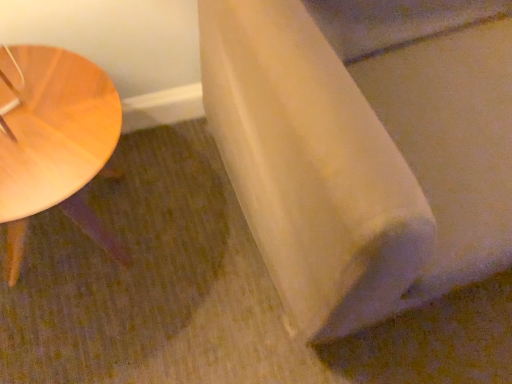
This screenshot has height=384, width=512. What do you see at coordinates (361, 159) in the screenshot?
I see `white matte fabric at lower right` at bounding box center [361, 159].

This screenshot has width=512, height=384. I want to click on white matte fabric at lower right, so click(361, 159).

Find the location of `light wood table at left`. light wood table at left is located at coordinates (x=53, y=141).

The height and width of the screenshot is (384, 512). What do you see at coordinates (53, 141) in the screenshot?
I see `light wood table at left` at bounding box center [53, 141].

Identify the location of white matte fabric at lower right. (361, 159).

Is light wood table at left to the left of white matte fabric at lower right from the viewer's perspective?

Indeed, light wood table at left is positioned on the left side of white matte fabric at lower right.

Considering the positions of objects light wood table at left and white matte fabric at lower right in the image provided, who is in front, light wood table at left or white matte fabric at lower right?

white matte fabric at lower right is more forward.

Which is closer, (x=22, y=169) or (x=296, y=79)?

The point (x=296, y=79) is closer to the camera.

From the image's perspective, is light wood table at left over white matte fabric at lower right?

Incorrect, from the image's perspective, light wood table at left is lower than white matte fabric at lower right.

From a real-world perspective, is light wood table at left located higher than white matte fabric at lower right?

No, from a real-world perspective, light wood table at left is not above white matte fabric at lower right.

Considering the relative sizes of light wood table at left and white matte fabric at lower right in the image provided, is light wood table at left thinner than white matte fabric at lower right?

Yes, light wood table at left is thinner than white matte fabric at lower right.

Considering the relative sizes of light wood table at left and white matte fabric at lower right in the image provided, is light wood table at left taller than white matte fabric at lower right?

In fact, light wood table at left may be shorter than white matte fabric at lower right.

Which of these two, light wood table at left or white matte fabric at lower right, is bigger?

white matte fabric at lower right is bigger.

Do you think light wood table at left is within white matte fabric at lower right, or outside of it?

light wood table at left exists outside the volume of white matte fabric at lower right.

Is light wood table at left placed right next to white matte fabric at lower right?

There is a gap between light wood table at left and white matte fabric at lower right.

Is light wood table at left oriented towards white matte fabric at lower right?

No.

This screenshot has height=384, width=512. Find the location of `table below the white matte fabric at lower right (from the image's perspective)`. table below the white matte fabric at lower right (from the image's perspective) is located at coordinates (53, 141).

Consider the image. Can you confirm if white matte fabric at lower right is positioned to the right of light wood table at left?

Correct, you'll find white matte fabric at lower right to the right of light wood table at left.

Which object is more forward, white matte fabric at lower right or light wood table at left?

white matte fabric at lower right.

Which is in front, point (465, 123) or point (10, 109)?

The point (10, 109) is closer.

Based on the photo, from the image's perspective, which is above, white matte fabric at lower right or light wood table at left?

white matte fabric at lower right appears higher in the image.

From a real-world perspective, does white matte fabric at lower right stand above light wood table at left?

Yes, from a real-world perspective, white matte fabric at lower right is above light wood table at left.

Which of these two, white matte fabric at lower right or light wood table at left, is wider?

Wider between the two is white matte fabric at lower right.

Considering the sizes of white matte fabric at lower right and light wood table at left in the image, is white matte fabric at lower right taller or shorter than light wood table at left?

Clearly, white matte fabric at lower right is taller compared to light wood table at left.

Considering the sizes of objects white matte fabric at lower right and light wood table at left in the image provided, who is smaller, white matte fabric at lower right or light wood table at left?

light wood table at left is smaller.

Would you say white matte fabric at lower right is outside light wood table at left?

Yes, white matte fabric at lower right is not within light wood table at left.

Are white matte fabric at lower right and light wood table at left far apart?

No, white matte fabric at lower right is not far from light wood table at left.

Is white matte fabric at lower right facing towards light wood table at left?

No, white matte fabric at lower right does not turn towards light wood table at left.

What's the angular difference between white matte fabric at lower right and light wood table at left's facing directions?

There is a 1.46-degree angle between the facing directions of white matte fabric at lower right and light wood table at left.

Image resolution: width=512 pixels, height=384 pixels. I want to click on table lying behind the white matte fabric at lower right, so click(53, 141).

Find the location of a particular element. This screenshot has width=512, height=384. table on the left of the white matte fabric at lower right is located at coordinates (53, 141).

Where is `linen in front of the light wood table at left`? This screenshot has height=384, width=512. linen in front of the light wood table at left is located at coordinates (361, 159).